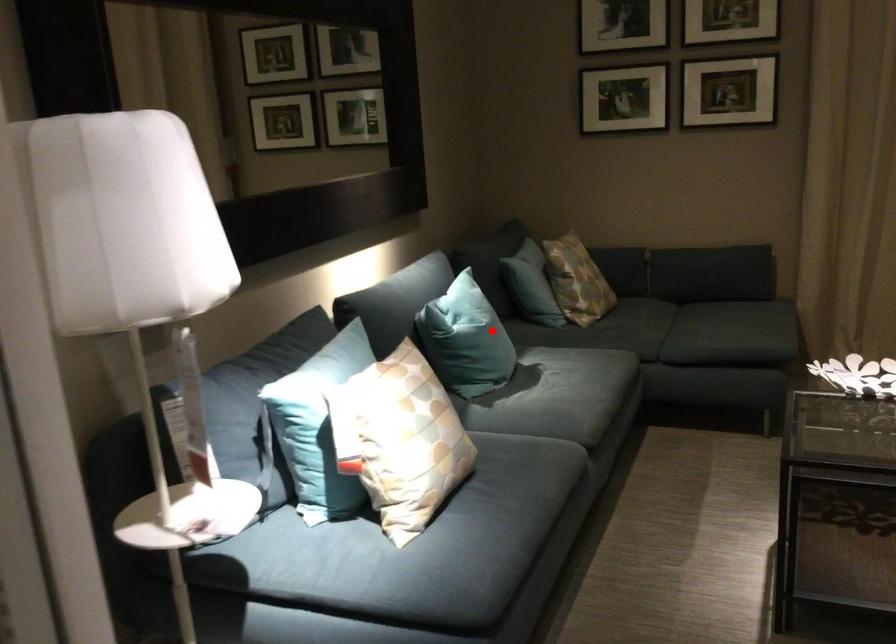
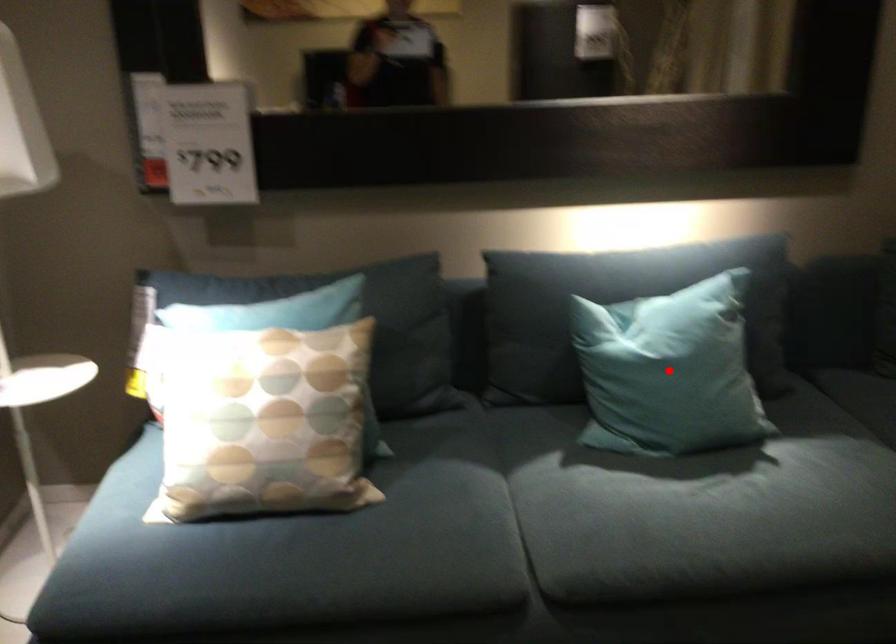
I am providing you with two images of the same scene from different viewpoints. A red point is marked on the first image and another point is marked on the second image. Does the point marked in image1 correspond to the same location as the one in image2?

Yes